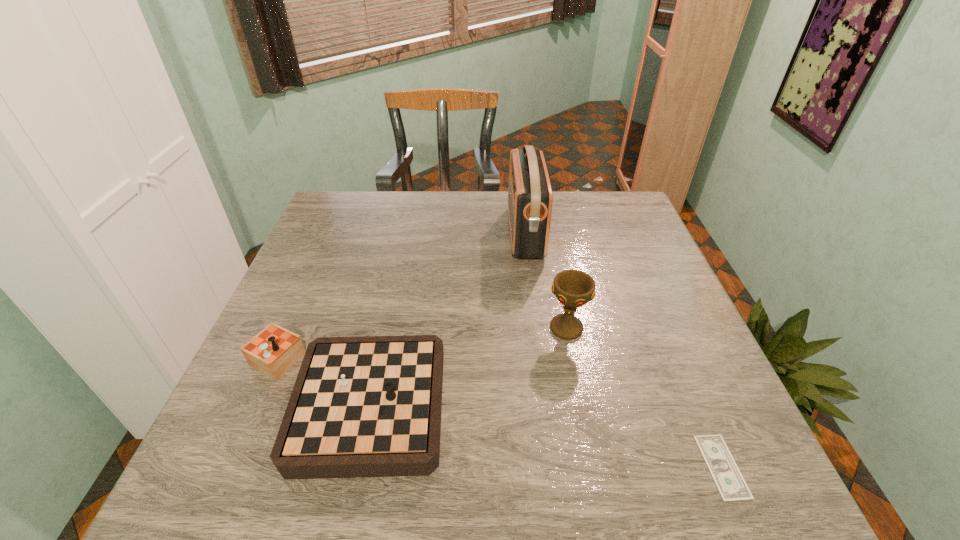
Identify the location of vacant space located 0.400m on the left of the third shortest object. (367, 328).

Find the location of a particular element. This screenshot has width=960, height=540. free space located 0.150m on the right of the leftmost object is located at coordinates (522, 400).

At what (x,y) coordinates should I click in order to perform the action: click on vacant space located on the back of the rightmost object. Please return your answer as a coordinate pair (x, y). The width and height of the screenshot is (960, 540). Looking at the image, I should click on (696, 406).

Find the location of a particular element. The height and width of the screenshot is (540, 960). object located at the far edge is located at coordinates (530, 198).

The image size is (960, 540). I want to click on chessboard at the near edge, so click(x=370, y=406).

You are a GUI agent. You are given a task and a screenshot of the screen. Output one action in this format:
    pyautogui.click(x=<x>, y=<y>)
    Task: Click on the money that is positioned at the near edge
    
    Given the screenshot: What is the action you would take?
    pyautogui.click(x=732, y=487)

Identify the location of object positioned at the left edge. This screenshot has width=960, height=540. (370, 406).

I want to click on object situated at the right edge, so click(x=732, y=487).

Identify the location of object at the near left corner. (370, 406).

This screenshot has height=540, width=960. Find the location of `object that is at the near right corner`. object that is at the near right corner is located at coordinates (732, 487).